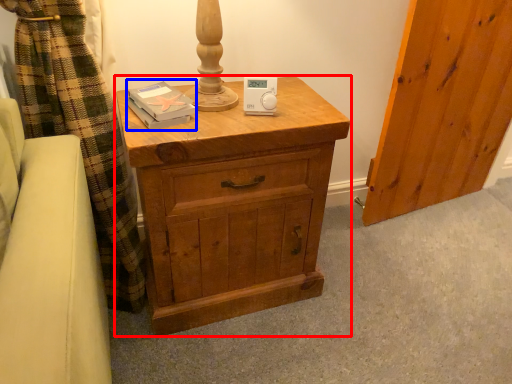
Question: Among these objects, which one is nearest to the camera, chest of drawers (highlighted by a red box) or book (highlighted by a blue box)?

Choices:
 (A) chest of drawers
 (B) book

Answer: (A)